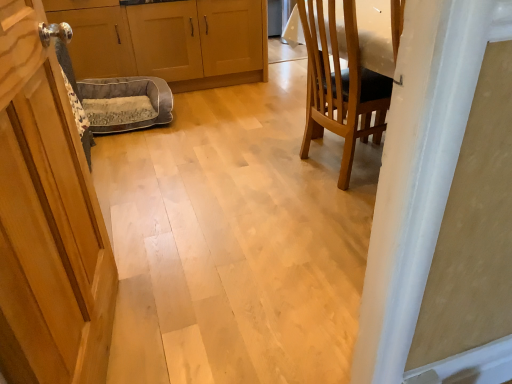
I want to click on vacant region in front of matte wood cabinets at center, acting as the 2th cabinetry starting from the left, so click(218, 112).